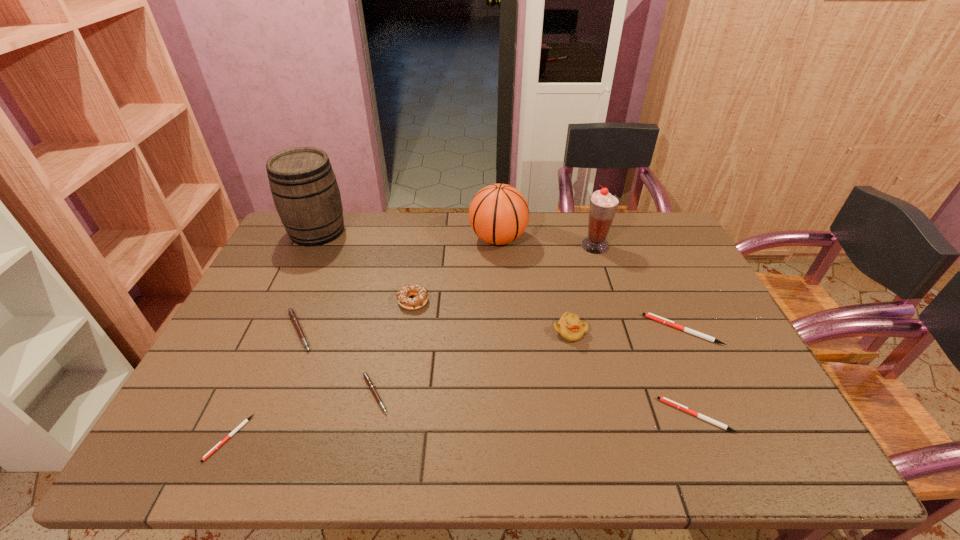
Where is `vacant region at the near left corner of the desktop`? This screenshot has width=960, height=540. vacant region at the near left corner of the desktop is located at coordinates (177, 462).

Locate an element on the screen. free space between the right pink pen and the biggest white pen is located at coordinates (529, 362).

Find the location of a particular element. The width and height of the screenshot is (960, 540). vacant space in between the third pen from right to left and the chocolate doughnut is located at coordinates 394,347.

Locate an element on the screen. This screenshot has width=960, height=540. free space between the second biggest white pen and the nearer pink pen is located at coordinates pyautogui.click(x=536, y=404).

Identify the location of free space between the orange basketball and the red smoothie. This screenshot has height=540, width=960. (546, 242).

Locate an element on the screen. free spot between the shortest pen and the sixth object from left to right is located at coordinates (364, 339).

Locate an element on the screen. vacant area between the tallest object and the farther pink pen is located at coordinates (308, 281).

In order to click on free space between the fourth tallest object and the nearer pink pen in this screenshot , I will do `click(472, 363)`.

Identify the location of free point between the left pink pen and the tallest object. (308, 281).

The width and height of the screenshot is (960, 540). In order to click on free space between the farthest white pen and the nearer pink pen in this screenshot , I will do `click(529, 362)`.